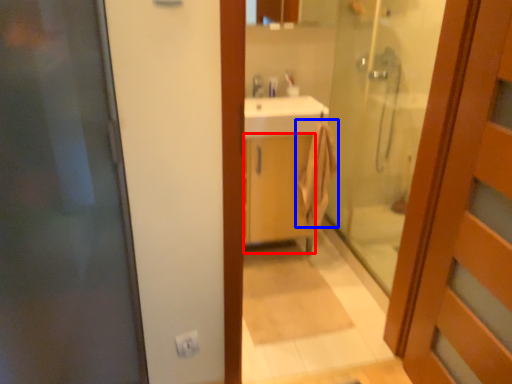
Question: Which object appears farthest to the camera in this image, cabinetry (highlighted by a red box) or bath towel (highlighted by a blue box)?

Choices:
 (A) cabinetry
 (B) bath towel

Answer: (B)